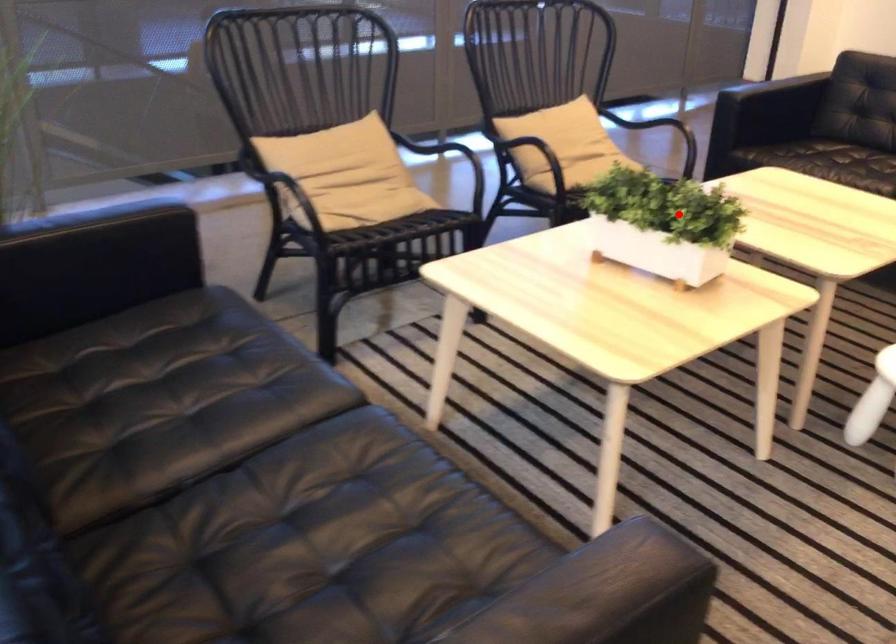
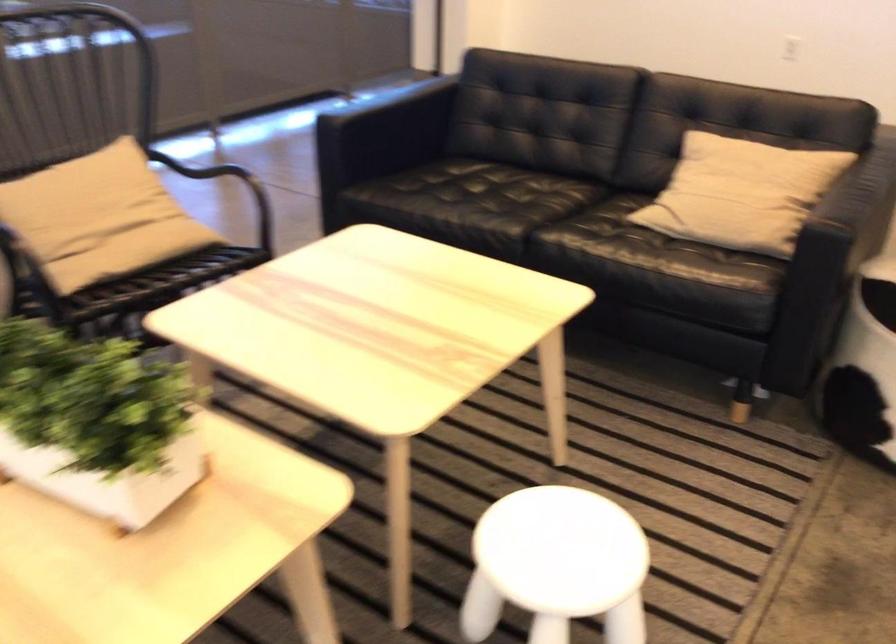
The point at the highlighted location is marked in the first image. Where is the corresponding point in the second image?

(96, 422)